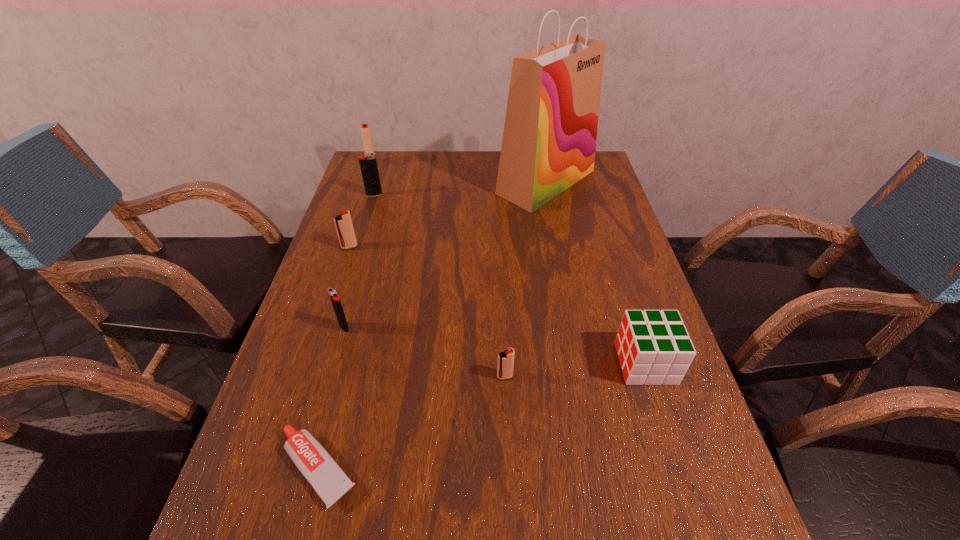
The width and height of the screenshot is (960, 540). Find the location of `vacant space located 0.220m on the red face of the red cube`. vacant space located 0.220m on the red face of the red cube is located at coordinates (518, 363).

The image size is (960, 540). What are the coordinates of `vacant space situated 0.220m on the red face of the red cube` in the screenshot? It's located at (518, 363).

Find the location of a particular element. free location located on the back of the nearest red igniter is located at coordinates (499, 265).

Where is `free space located on the back of the toothpaste`? This screenshot has width=960, height=540. free space located on the back of the toothpaste is located at coordinates (342, 377).

Locate an element on the screen. The height and width of the screenshot is (540, 960). shopping bag that is at the far edge is located at coordinates (549, 141).

The image size is (960, 540). What are the coordinates of `igniter that is positioned at the far edge` in the screenshot? It's located at (365, 129).

Locate an element on the screen. This screenshot has height=540, width=960. toothpaste located in the left edge section of the desktop is located at coordinates (329, 481).

This screenshot has width=960, height=540. What are the coordinates of `shopping bag that is positioned at the right edge` in the screenshot? It's located at (549, 141).

The height and width of the screenshot is (540, 960). In order to click on cube that is positioned at the right edge in this screenshot , I will do `click(654, 347)`.

The image size is (960, 540). What are the coordinates of `object that is at the far left corner` in the screenshot? It's located at (365, 129).